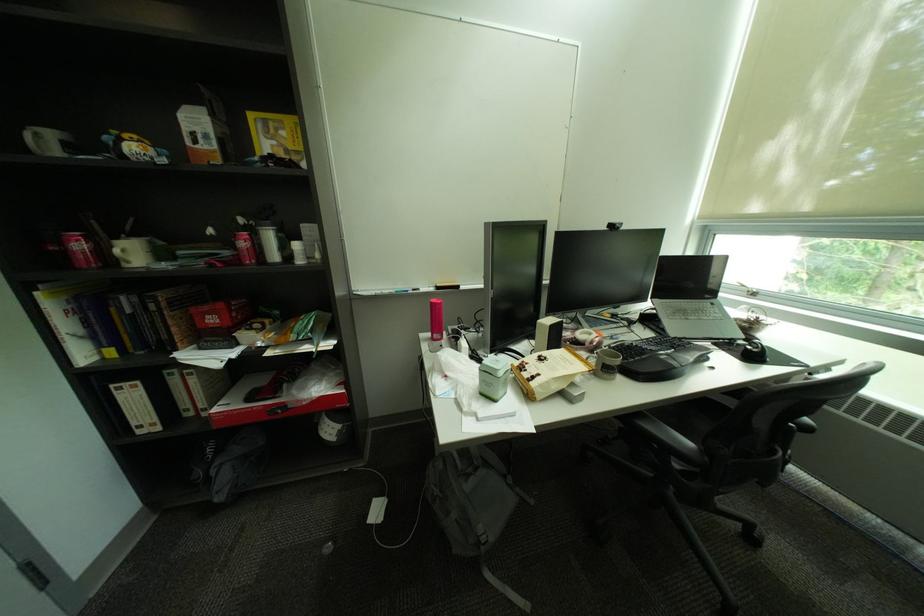
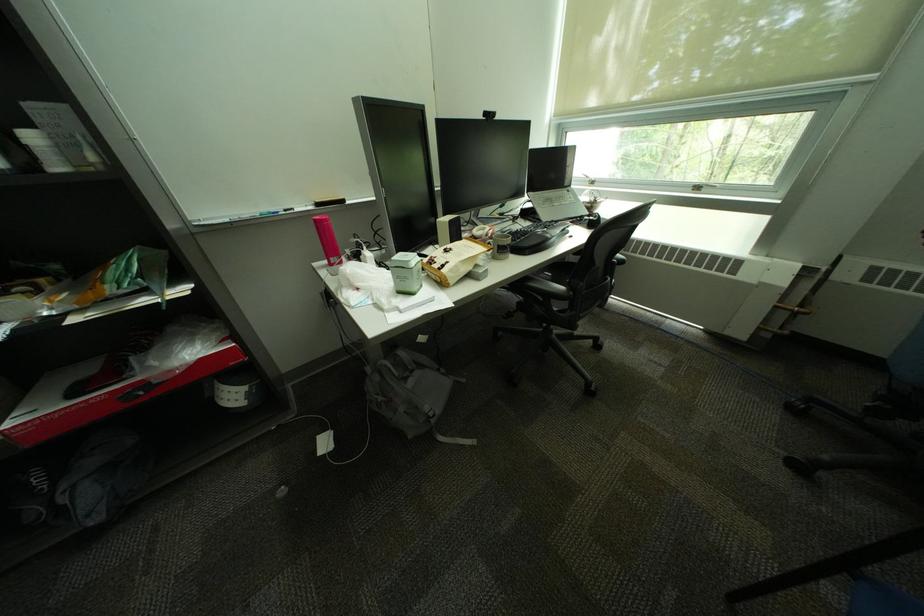
What movement of the cameraman would produce the second image?

The cameraman moved toward left, backward.